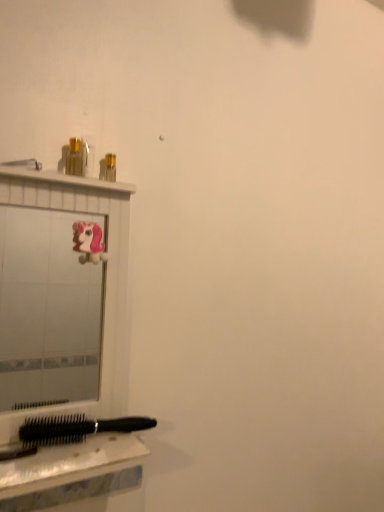
Question: From a real-world perspective, is white glossy mirror at upper left beneath black plastic hairbrush at lower left?

Choices:
 (A) yes
 (B) no

Answer: (B)

Question: From a real-world perspective, is white glossy mirror at upper left over black plastic hairbrush at lower left?

Choices:
 (A) no
 (B) yes

Answer: (B)

Question: Considering the relative sizes of white glossy mirror at upper left and black plastic hairbrush at lower left in the image provided, is white glossy mirror at upper left wider than black plastic hairbrush at lower left?

Choices:
 (A) no
 (B) yes

Answer: (A)

Question: Is white glossy mirror at upper left positioned behind black plastic hairbrush at lower left?

Choices:
 (A) no
 (B) yes

Answer: (B)

Question: Does white glossy mirror at upper left have a lesser height compared to black plastic hairbrush at lower left?

Choices:
 (A) no
 (B) yes

Answer: (A)

Question: In terms of height, does black plastic hairbrush at lower left look taller or shorter compared to white glossy mirror at upper left?

Choices:
 (A) short
 (B) tall

Answer: (A)

Question: In the image, is black plastic hairbrush at lower left positioned in front of or behind white glossy mirror at upper left?

Choices:
 (A) behind
 (B) front

Answer: (B)

Question: Choose the correct answer: Is black plastic hairbrush at lower left inside white glossy mirror at upper left or outside it?

Choices:
 (A) outside
 (B) inside

Answer: (A)

Question: Would you say black plastic hairbrush at lower left is to the left or to the right of white glossy mirror at upper left in the picture?

Choices:
 (A) left
 (B) right

Answer: (A)

Question: Is point (104, 492) closer or farther from the camera than point (71, 150)?

Choices:
 (A) farther
 (B) closer

Answer: (A)

Question: Is black plastic hairbrush at lower left taller or shorter than metallic gold toiletry at upper left?

Choices:
 (A) short
 (B) tall

Answer: (A)

Question: From the image's perspective, is black plastic hairbrush at lower left positioned above or below metallic gold toiletry at upper left?

Choices:
 (A) above
 (B) below

Answer: (B)

Question: Is black plastic hairbrush at lower left bigger or smaller than metallic gold toiletry at upper left?

Choices:
 (A) small
 (B) big

Answer: (B)

Question: From a real-world perspective, relative to black plastic hairbrush at lower left, is metallic gold toiletry at upper left vertically above or below?

Choices:
 (A) above
 (B) below

Answer: (A)

Question: Based on their sizes in the image, would you say metallic gold toiletry at upper left is bigger or smaller than black plastic hairbrush at lower left?

Choices:
 (A) small
 (B) big

Answer: (A)